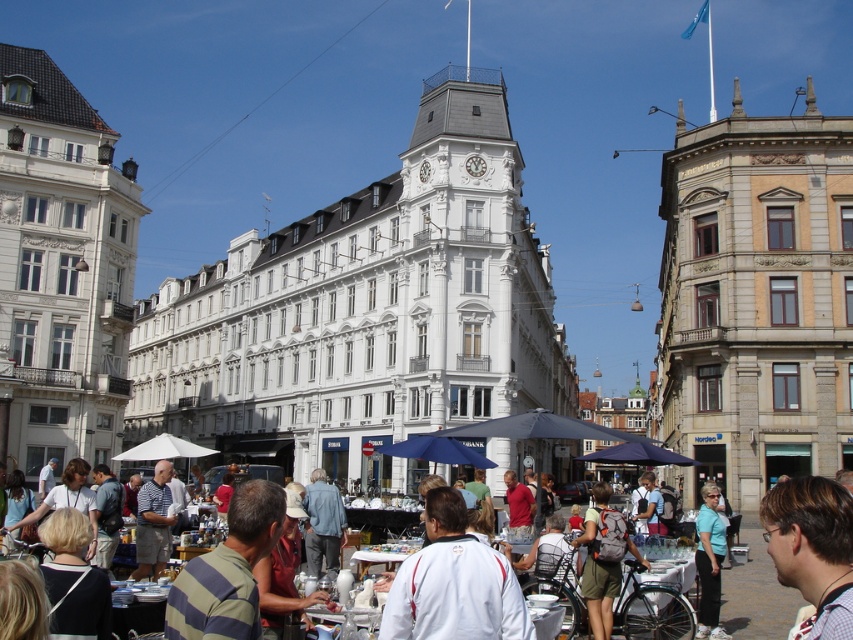
What is located at the point with coordinates (453, 582) in the image?

The white cotton shirt at center is located at point (453, 582).